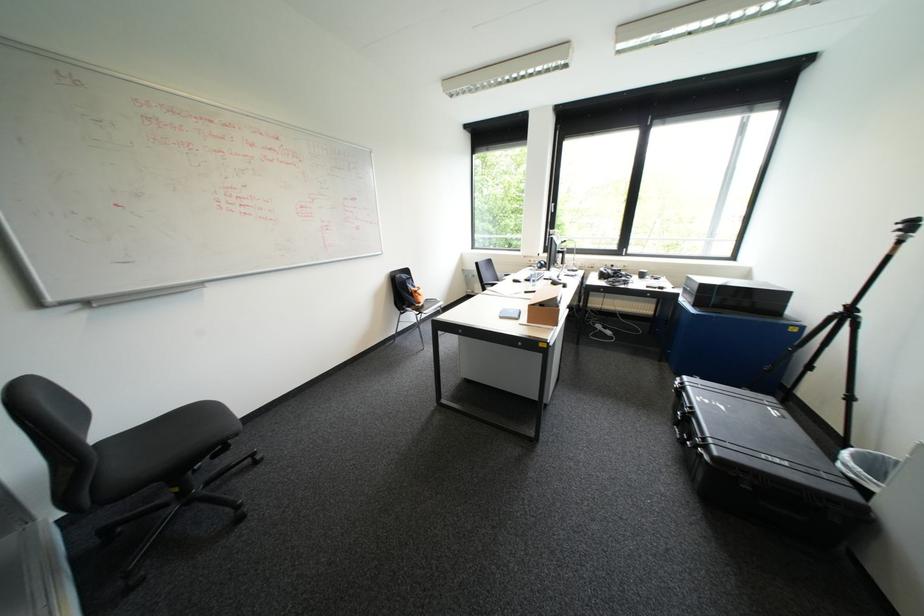
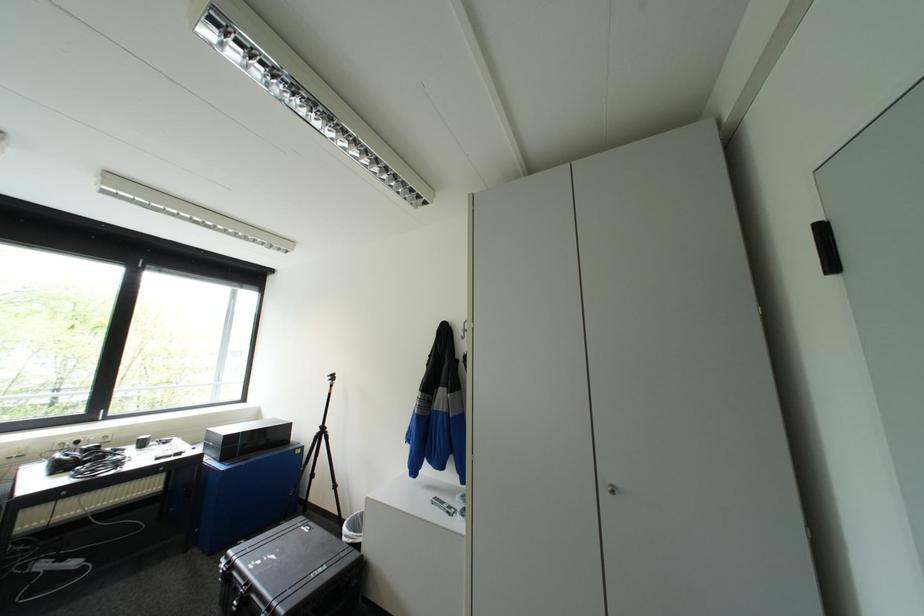
Question: The first image is from the beginning of the video and the second image is from the end. How did the camera likely rotate when shooting the video?

Choices:
 (A) Left
 (B) Right
 (C) Up
 (D) Down

Answer: (B)